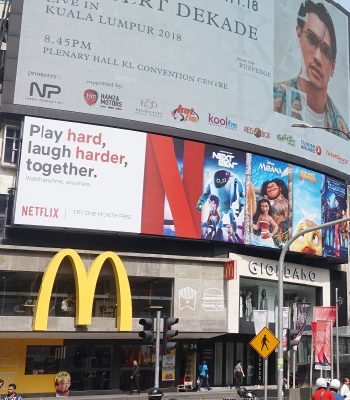
Locate an element on the screen. This screenshot has height=400, width=350. restaurant table is located at coordinates (154, 307), (110, 307), (30, 305).